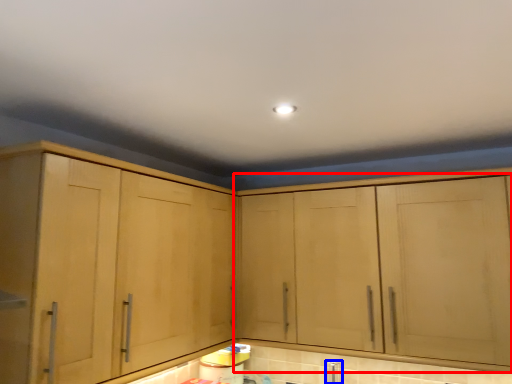
Question: Which of the following is the closest to the observer, cabinetry (highlighted by a red box) or faucet (highlighted by a blue box)?

Choices:
 (A) cabinetry
 (B) faucet

Answer: (A)